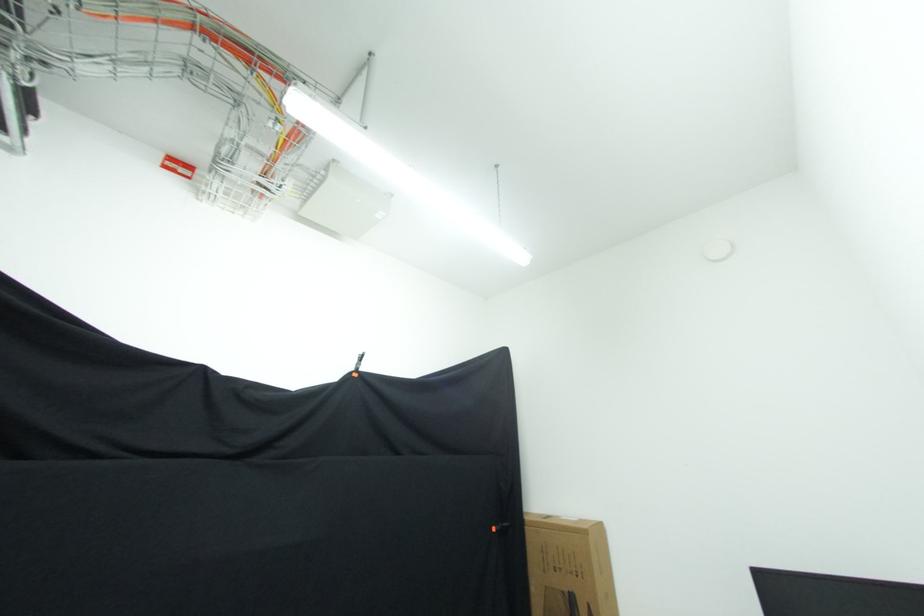
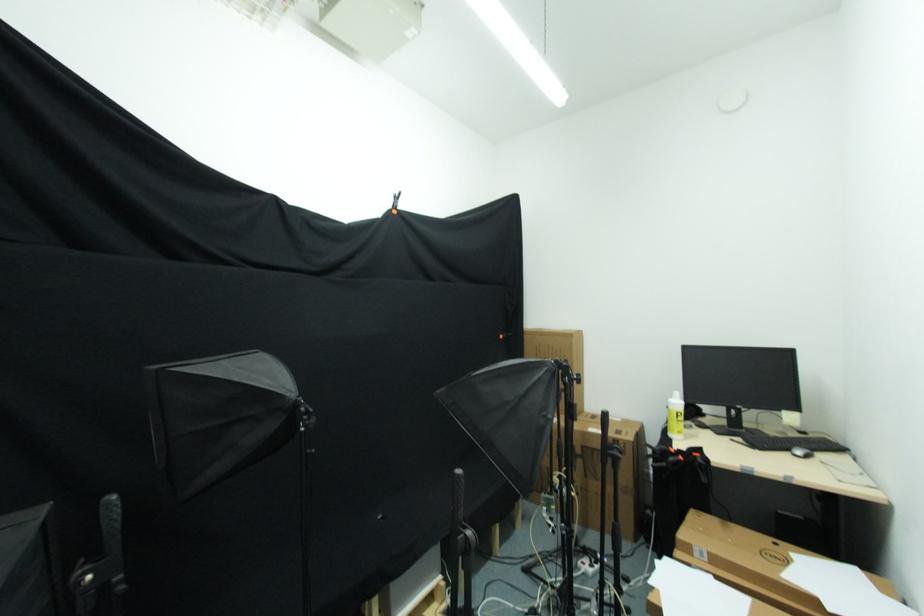
The images are taken continuously from a first-person perspective. In which direction are you moving?

The cameraman moved toward left, backward.